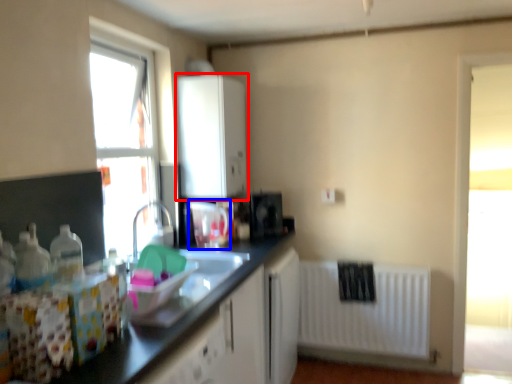
Question: Among these objects, which one is nearest to the camera, cabinetry (highlighted by a red box) or appliance (highlighted by a blue box)?

Choices:
 (A) cabinetry
 (B) appliance

Answer: (B)